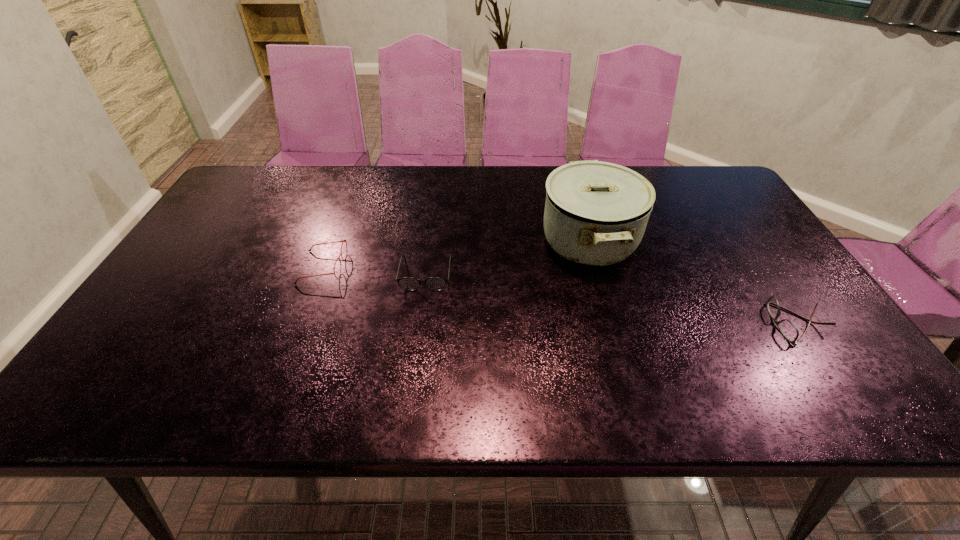
I want to click on vacant region between the second spectacles from left to right and the third object from left to right, so click(x=507, y=257).

The height and width of the screenshot is (540, 960). Identify the location of vacant area that lies between the leftmost object and the rightmost object. (561, 295).

The height and width of the screenshot is (540, 960). I want to click on vacant space that's between the leftmost object and the third object from right to left, so click(x=374, y=271).

The image size is (960, 540). Identify the location of vacant area between the leftmost object and the rightmost spectacles. (561, 295).

Identify the location of free space between the second object from left to right and the rightmost object. This screenshot has width=960, height=540. (612, 299).

Locate an element on the screen. Image resolution: width=960 pixels, height=540 pixels. free space that is in between the third object from left to right and the second spectacles from left to right is located at coordinates (507, 257).

The image size is (960, 540). Identify the location of free space between the tallest object and the third object from right to left. (507, 257).

Where is `vacant area between the rightmost spectacles and the saucepan`? This screenshot has width=960, height=540. vacant area between the rightmost spectacles and the saucepan is located at coordinates (693, 282).

Image resolution: width=960 pixels, height=540 pixels. In order to click on vacant region between the saucepan and the nearest spectacles in this screenshot , I will do `click(693, 282)`.

Locate an element on the screen. This screenshot has height=540, width=960. free space between the rightmost spectacles and the second object from left to right is located at coordinates (612, 299).